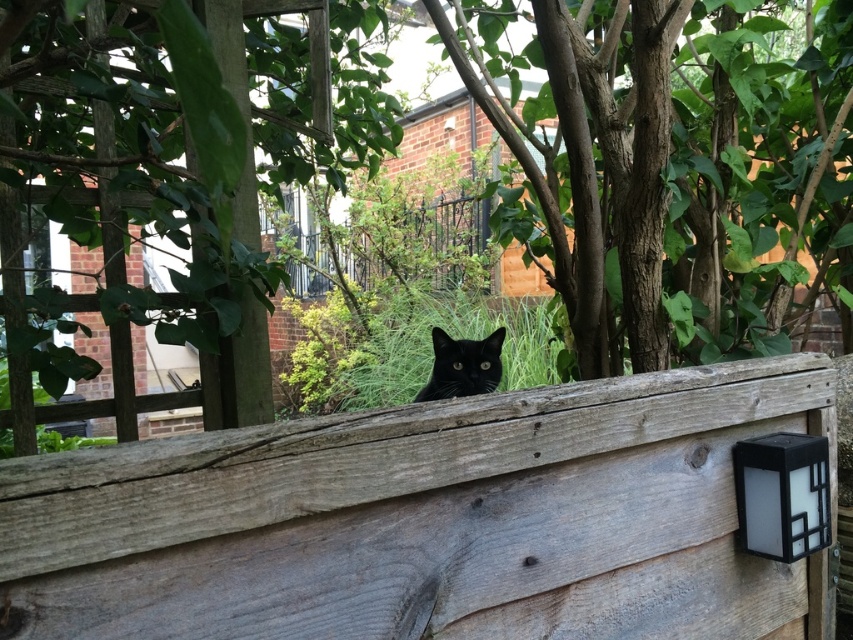
Question: Does green leafy tree at center appear on the left side of weathered wood fence at center?

Choices:
 (A) yes
 (B) no

Answer: (B)

Question: Considering the real-world distances, which object is closest to the weathered wood fence at center?

Choices:
 (A) black matte cat at center
 (B) white plastic lamp at upper right
 (C) green leafy tree at center

Answer: (B)

Question: Which point is farther to the camera?

Choices:
 (A) green leafy tree at center
 (B) weathered wood fence at center
 (C) black matte cat at center

Answer: (C)

Question: Considering the relative positions of green leafy tree at center and weathered wood fence at center in the image provided, where is green leafy tree at center located with respect to weathered wood fence at center?

Choices:
 (A) left
 (B) right

Answer: (B)

Question: Can you confirm if weathered wood fence at center is bigger than white plastic lamp at upper right?

Choices:
 (A) yes
 (B) no

Answer: (A)

Question: Among these objects, which one is farthest from the camera?

Choices:
 (A) white plastic lamp at upper right
 (B) black matte cat at center
 (C) weathered wood fence at center

Answer: (B)